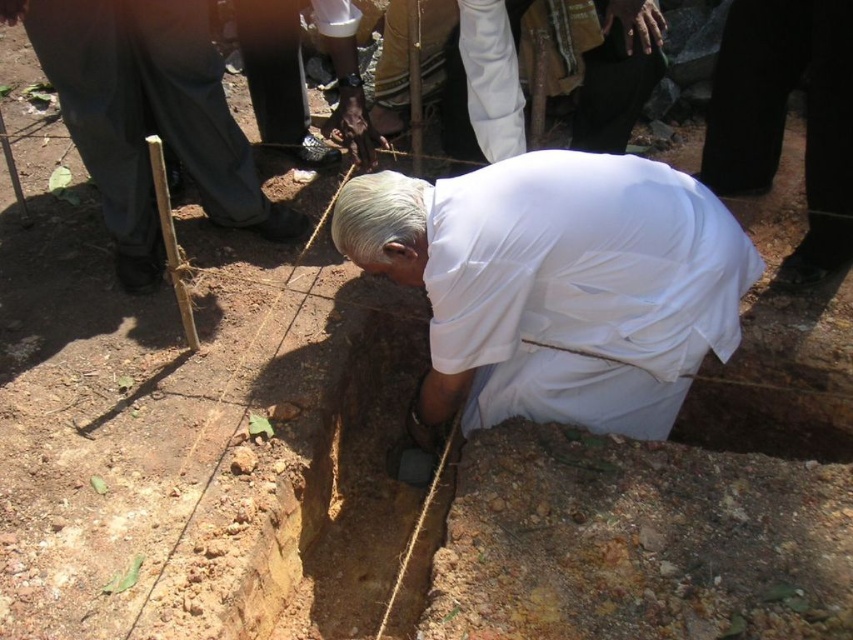
You are an observer standing in the scene. You notice the smooth wooden stick at lower left and the white cloth at lower right. Which object is shorter?

The smooth wooden stick at lower left has a lesser height compared to the white cloth at lower right, so the smooth wooden stick at lower left is shorter.

You are a photographer standing at the edge of the trench. You want to capture a clear photo of both the smooth wooden stick at lower left and the white cloth at lower right. Which object should you focus on first to ensure both are in focus?

The smooth wooden stick at lower left is in front of the white cloth at lower right, so you should focus on the smooth wooden stick at lower left first to ensure both are in focus.